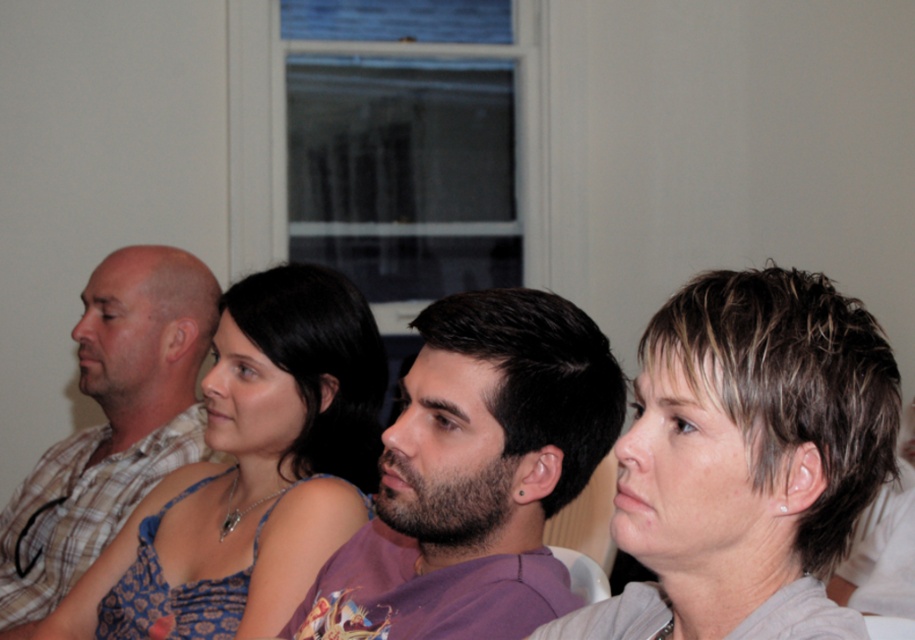
Looking at this image, you are taking a photo of the group and want to focus on the person at point (658, 374) and the person at point (288, 541). Which person will appear larger in the photo?

The person at point (658, 374) will appear larger in the photo because they are closer to the camera than the person at point (288, 541).